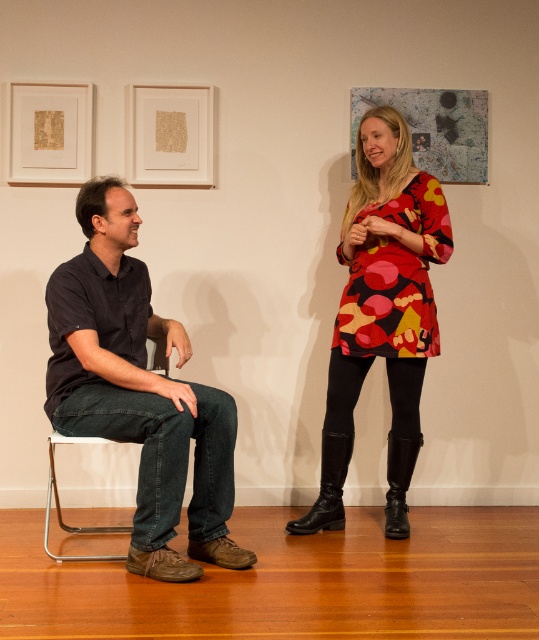
Describe the element at coordinates (139, 392) in the screenshot. I see `black matte shirt at left` at that location.

Is point (87, 246) positioned before point (46, 529)?

No, (87, 246) is further to viewer.

Image resolution: width=539 pixels, height=640 pixels. Identify the location of black matte shirt at left. (139, 392).

How distant is printed fabric dress at center from metallic silver chair at left?

printed fabric dress at center is 1.08 meters away from metallic silver chair at left.

Does printed fabric dress at center have a greater height compared to metallic silver chair at left?

Correct, printed fabric dress at center is much taller as metallic silver chair at left.

Does point (363, 326) come closer to viewer compared to point (53, 445)?

Yes, it is.

At what (x,y) coordinates should I click in order to perform the action: click on printed fabric dress at center. Please return your answer as a coordinate pair (x, y). Looking at the image, I should click on (382, 312).

I want to click on black matte shirt at left, so click(x=139, y=392).

Between point (99, 328) and point (355, 228), which one is positioned in front?

Point (99, 328) is more forward.

Identify the location of black matte shirt at left. The width and height of the screenshot is (539, 640). tap(139, 392).

At what (x,y) coordinates should I click in order to perform the action: click on black matte shirt at left. Please return your answer as a coordinate pair (x, y). Looking at the image, I should click on (139, 392).